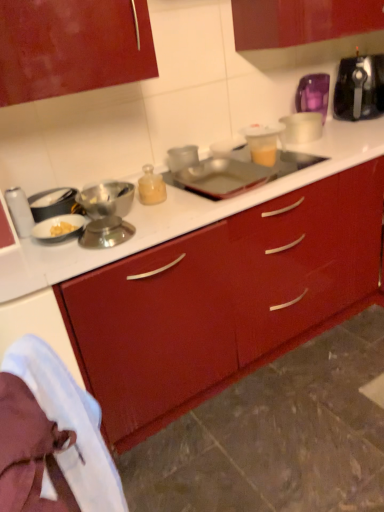
Question: From the image's perspective, is translucent plastic cup at upper right, the first appliance in the right-to-left sequence, under black plastic toaster at upper right?

Choices:
 (A) no
 (B) yes

Answer: (B)

Question: From a real-world perspective, is translucent plastic cup at upper right, which is counted as the fourth appliance, starting from the left, on black plastic toaster at upper right?

Choices:
 (A) yes
 (B) no

Answer: (B)

Question: Considering the relative sizes of translucent plastic cup at upper right, which is counted as the fourth appliance, starting from the left, and black plastic toaster at upper right in the image provided, is translucent plastic cup at upper right, which is counted as the fourth appliance, starting from the left, shorter than black plastic toaster at upper right?

Choices:
 (A) no
 (B) yes

Answer: (B)

Question: Is translucent plastic cup at upper right, which is counted as the fourth appliance, starting from the left, closer to the viewer compared to black plastic toaster at upper right?

Choices:
 (A) no
 (B) yes

Answer: (B)

Question: Is translucent plastic cup at upper right, the first appliance in the right-to-left sequence, oriented towards black plastic toaster at upper right?

Choices:
 (A) no
 (B) yes

Answer: (A)

Question: Based on their positions, is translucent plastic cup at upper right, the first appliance in the right-to-left sequence, located to the left or right of white fabric at lower left?

Choices:
 (A) left
 (B) right

Answer: (B)

Question: Is point (299, 115) positioned closer to the camera than point (54, 388)?

Choices:
 (A) closer
 (B) farther

Answer: (B)

Question: Looking at their shapes, would you say translucent plastic cup at upper right, the first appliance in the right-to-left sequence, is wider or thinner than white fabric at lower left?

Choices:
 (A) thin
 (B) wide

Answer: (B)

Question: Is translucent plastic cup at upper right, the first appliance in the right-to-left sequence, in front of or behind white fabric at lower left in the image?

Choices:
 (A) front
 (B) behind

Answer: (B)

Question: Considering their positions, is white fabric at lower left located in front of or behind translucent plastic cup at upper right, which is counted as the fourth appliance, starting from the left?

Choices:
 (A) behind
 (B) front

Answer: (B)

Question: Would you say white fabric at lower left is to the left or to the right of translucent plastic cup at upper right, the first appliance in the right-to-left sequence, in the picture?

Choices:
 (A) right
 (B) left

Answer: (B)

Question: Which is correct: white fabric at lower left is inside translucent plastic cup at upper right, which is counted as the fourth appliance, starting from the left, or outside of it?

Choices:
 (A) inside
 (B) outside

Answer: (B)

Question: Is white fabric at lower left wider or thinner than translucent plastic cup at upper right, which is counted as the fourth appliance, starting from the left?

Choices:
 (A) thin
 (B) wide

Answer: (A)

Question: Considering their positions, is metallic canister at left, arranged as the 4th appliance when viewed from the right, located in front of or behind metallic silver tray at center, the second appliance from the left?

Choices:
 (A) behind
 (B) front

Answer: (B)

Question: From a real-world perspective, is metallic canister at left, arranged as the 4th appliance when viewed from the right, physically located above or below metallic silver tray at center, the second appliance from the left?

Choices:
 (A) below
 (B) above

Answer: (B)